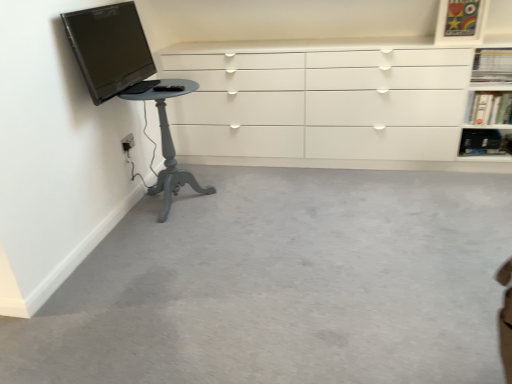
Question: In terms of height, does black plastic shelf at upper right, the first shelf positioned from the bottom, look taller or shorter compared to matte gray pedestal table at left?

Choices:
 (A) short
 (B) tall

Answer: (A)

Question: Considering the positions of black plastic shelf at upper right, the first shelf positioned from the bottom, and matte gray pedestal table at left in the image, is black plastic shelf at upper right, the first shelf positioned from the bottom, wider or thinner than matte gray pedestal table at left?

Choices:
 (A) wide
 (B) thin

Answer: (B)

Question: Based on their relative distances, which object is nearer to the matte gray pedestal table at left?

Choices:
 (A) white glossy bookshelf at upper right, which is counted as the second shelf, starting from the top
 (B) black plastic shelf at upper right, the first shelf positioned from the bottom
 (C) white glossy chest of drawers at upper center
 (D) white plastic electric outlet at lower left
 (E) matte black tv at upper left

Answer: (D)

Question: Which object is the farthest from the white glossy bookshelf at upper right, acting as the 3th shelf starting from the bottom?

Choices:
 (A) white glossy bookshelf at upper right, which is counted as the second shelf, starting from the top
 (B) matte gray pedestal table at left
 (C) white glossy chest of drawers at upper center
 (D) matte black tv at upper left
 (E) white plastic electric outlet at lower left

Answer: (E)